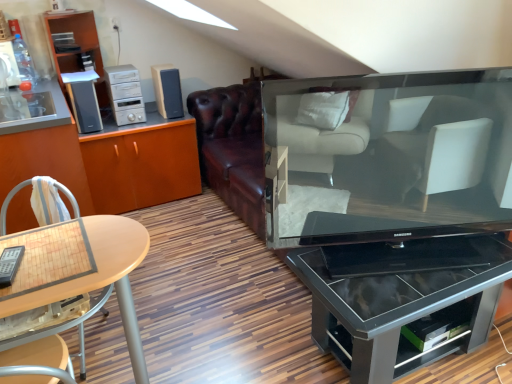
You are a GUI agent. You are given a task and a screenshot of the screen. Output one action in this format:
    pyautogui.click(x=<x>, y=<y>)
    Task: Click on the matte wood shelf at upper left
    
    Given the screenshot: What is the action you would take?
    pyautogui.click(x=77, y=55)

In order to click on satin black speaker at upper left, arranged as the second appliance when viewed from the right in this screenshot , I will do [x=84, y=100].

What is the approximate height of satin black speaker at upper left, acting as the 1th appliance starting from the left?

The height of satin black speaker at upper left, acting as the 1th appliance starting from the left, is 13.58 inches.

At what (x,y) coordinates should I click in order to perform the action: click on wooden light brown chair at lower left. Please return your answer as a coordinate pair (x, y). Looking at the image, I should click on (58, 323).

This screenshot has width=512, height=384. Describe the element at coordinates (42, 201) in the screenshot. I see `white woven fabric at left` at that location.

Locate an element on the screen. wooden cabinet at left, arranged as the second cabinetry when viewed from the right is located at coordinates (45, 151).

Find the location of a particular element. The image size is (512, 384). matte wood shelf at upper left is located at coordinates (77, 55).

From the image's perspective, who appears lower, matte wood cabinet at left, positioned as the first cabinetry in right-to-left order, or silver metallic stereo at upper left, the 1th appliance in the right-to-left sequence?

From the image's view, matte wood cabinet at left, positioned as the first cabinetry in right-to-left order, is below.

Is matte wood cabinet at left, positioned as the first cabinetry in right-to-left order, at the left side of silver metallic stereo at upper left, the 1th appliance in the right-to-left sequence?

Indeed, matte wood cabinet at left, positioned as the first cabinetry in right-to-left order, is positioned on the left side of silver metallic stereo at upper left, the 1th appliance in the right-to-left sequence.

Is matte wood cabinet at left, positioned as the first cabinetry in right-to-left order, completely or partially outside of silver metallic stereo at upper left, which is the 2th appliance from left to right?

Yes, matte wood cabinet at left, positioned as the first cabinetry in right-to-left order, is not within silver metallic stereo at upper left, which is the 2th appliance from left to right.

Is point (190, 159) closer or farther from the camera than point (138, 105)?

Point (190, 159).

What's the angular difference between silver metallic stereo at upper left, which is the 2th appliance from left to right, and black glossy television at center's facing directions?

21 degrees.

You are a GUI agent. You are given a task and a screenshot of the screen. Output one action in this format:
    pyautogui.click(x=<x>, y=<y>)
    Task: Click on the 2nd appliance behind the black glossy television at center
    The image size is (512, 384).
    Given the screenshot: What is the action you would take?
    pyautogui.click(x=125, y=94)

Is silver metallic stereo at upper left, which is the 2th appliance from left to right, turned away from black glossy television at center?

No, black glossy television at center is not at the back of silver metallic stereo at upper left, which is the 2th appliance from left to right.

Can you confirm if silver metallic stereo at upper left, which is the 2th appliance from left to right, is wider than black glossy television at center?

Indeed, silver metallic stereo at upper left, which is the 2th appliance from left to right, has a greater width compared to black glossy television at center.

Is matte wood shelf at upper left at the back of black glass table at center?

Yes, black glass table at center's orientation is away from matte wood shelf at upper left.

Which is more to the left, black glass table at center or matte wood shelf at upper left?

matte wood shelf at upper left is more to the left.

From the image's perspective, which is below, black glass table at center or matte wood shelf at upper left?

black glass table at center is shown below in the image.

Is point (446, 266) more distant than point (90, 52)?

No, it is not.

Is matte wood cabinet at left, positioned as the first cabinetry in right-to-left order, far away from matte wood shelf at upper left?

No.

Is matte wood cabinet at left, positioned as the first cabinetry in right-to-left order, thinner than matte wood shelf at upper left?

No, matte wood cabinet at left, positioned as the first cabinetry in right-to-left order, is not thinner than matte wood shelf at upper left.

The width and height of the screenshot is (512, 384). In order to click on cabinetry located behind the matte wood shelf at upper left in this screenshot , I will do `click(141, 163)`.

From a real-world perspective, which is physically above, matte wood cabinet at left, the 2th cabinetry from the left, or matte wood shelf at upper left?

matte wood shelf at upper left.

In terms of width, does satin black speaker at upper left, acting as the 1th appliance starting from the left, look wider or thinner when compared to slate gray plastic speaker at upper left?

Considering their sizes, satin black speaker at upper left, acting as the 1th appliance starting from the left, looks slimmer than slate gray plastic speaker at upper left.

Can you confirm if satin black speaker at upper left, acting as the 1th appliance starting from the left, is taller than slate gray plastic speaker at upper left?

Yes.

Which object is positioned more to the left, satin black speaker at upper left, arranged as the second appliance when viewed from the right, or slate gray plastic speaker at upper left?

satin black speaker at upper left, arranged as the second appliance when viewed from the right, is more to the left.

How far apart are satin black speaker at upper left, arranged as the second appliance when viewed from the right, and slate gray plastic speaker at upper left?

19.27 inches.

Is satin black speaker at upper left, acting as the 1th appliance starting from the left, with silver metallic stereo at upper left, the 1th appliance in the right-to-left sequence?

There is a gap between satin black speaker at upper left, acting as the 1th appliance starting from the left, and silver metallic stereo at upper left, the 1th appliance in the right-to-left sequence.

Based on the photo, in terms of width, does satin black speaker at upper left, arranged as the second appliance when viewed from the right, look wider or thinner when compared to silver metallic stereo at upper left, which is the 2th appliance from left to right?

Considering their sizes, satin black speaker at upper left, arranged as the second appliance when viewed from the right, looks broader than silver metallic stereo at upper left, which is the 2th appliance from left to right.

From the image's perspective, between satin black speaker at upper left, arranged as the second appliance when viewed from the right, and silver metallic stereo at upper left, which is the 2th appliance from left to right, which one is located above?

silver metallic stereo at upper left, which is the 2th appliance from left to right, appears higher in the image.

From a real-world perspective, between satin black speaker at upper left, acting as the 1th appliance starting from the left, and silver metallic stereo at upper left, the 1th appliance in the right-to-left sequence, who is vertically lower?

In real-world perspective, satin black speaker at upper left, acting as the 1th appliance starting from the left, is lower.

Is white woven fabric at left next to silver metallic stereo at upper left, which is the 2th appliance from left to right?

No, white woven fabric at left is not with silver metallic stereo at upper left, which is the 2th appliance from left to right.

Between white woven fabric at left and silver metallic stereo at upper left, the 1th appliance in the right-to-left sequence, which one has smaller width?

Thinner between the two is white woven fabric at left.

From the image's perspective, starting from the silver metallic stereo at upper left, which is the 2th appliance from left to right, which cabinetry is the 1st one below? Please provide its 2D coordinates.

[(141, 163)]

There is a black glossy television at center. Identify the location of the 2nd appliance above it (from the image's perspective). (125, 94).

Based on their spatial positions, is wooden cabinet at left, arranged as the second cabinetry when viewed from the right, or matte wood cabinet at left, the 2th cabinetry from the left, closer to slate gray plastic speaker at upper left?

matte wood cabinet at left, the 2th cabinetry from the left, lies closer to slate gray plastic speaker at upper left than the other object.

Which object lies further to the anchor point white woven fabric at left, black glass table at center or wooden cabinet at left, arranged as the second cabinetry when viewed from the right?

black glass table at center.

Considering their positions, is white woven fabric at left positioned closer to wooden light brown chair at lower left than wooden cabinet at left, arranged as the second cabinetry when viewed from the right?

Based on the image, white woven fabric at left appears to be nearer to wooden light brown chair at lower left.

When comparing their distances from satin black speaker at upper left, arranged as the second appliance when viewed from the right, does wooden light brown chair at lower left or slate gray plastic speaker at upper left seem further?

wooden light brown chair at lower left is further to satin black speaker at upper left, arranged as the second appliance when viewed from the right.

Which object lies further to the anchor point satin black speaker at upper left, arranged as the second appliance when viewed from the right, wooden cabinet at left, the 1th cabinetry in the left-to-right sequence, or black glass table at center?

black glass table at center.

Estimate the real-world distances between objects in this image. Which object is further from slate gray plastic speaker at upper left, matte wood cabinet at left, the 2th cabinetry from the left, or wooden light brown chair at lower left?

wooden light brown chair at lower left is positioned further to the anchor slate gray plastic speaker at upper left.

Which object lies further to the anchor point wooden cabinet at left, arranged as the second cabinetry when viewed from the right, matte wood cabinet at left, the 2th cabinetry from the left, or silver metallic stereo at upper left, which is the 2th appliance from left to right?

silver metallic stereo at upper left, which is the 2th appliance from left to right.

Which object lies further to the anchor point matte wood shelf at upper left, black glass table at center or wooden cabinet at left, the 1th cabinetry in the left-to-right sequence?

The object further to matte wood shelf at upper left is black glass table at center.

What are the coordinates of `armchair positioned between wooden light brown chair at lower left and satin black speaker at upper left, arranged as the second appliance when viewed from the right, from near to far` in the screenshot? It's located at (42, 201).

Locate an element on the screen. This screenshot has height=384, width=512. shelf between white woven fabric at left and matte wood cabinet at left, the 2th cabinetry from the left, along the z-axis is located at coordinates (77, 55).

Identify the location of appliance between white woven fabric at left and matte wood cabinet at left, positioned as the first cabinetry in right-to-left order, in the front-back direction. The width and height of the screenshot is (512, 384). (84, 100).

The height and width of the screenshot is (384, 512). Identify the location of shelf between wooden cabinet at left, the 1th cabinetry in the left-to-right sequence, and silver metallic stereo at upper left, the 1th appliance in the right-to-left sequence, in the front-back direction. (77, 55).